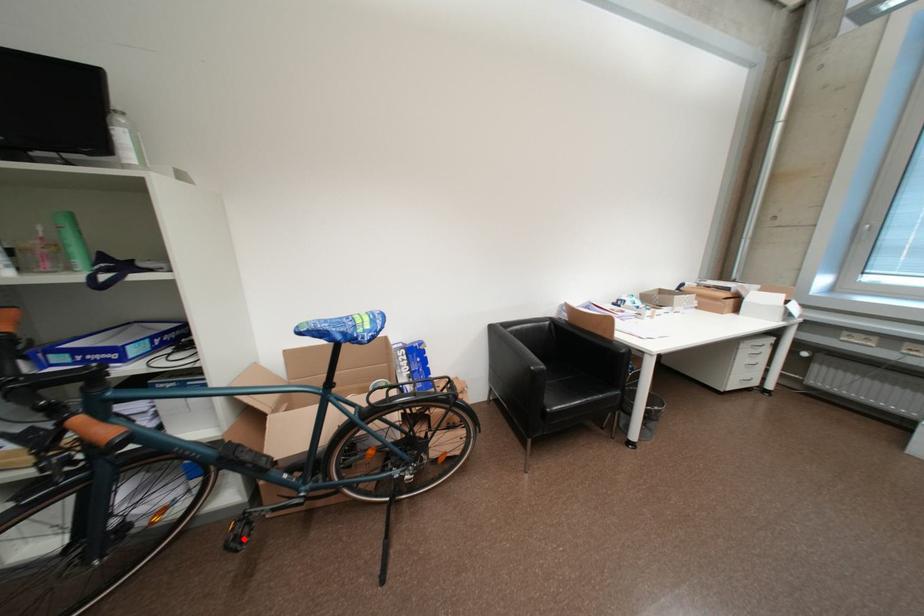
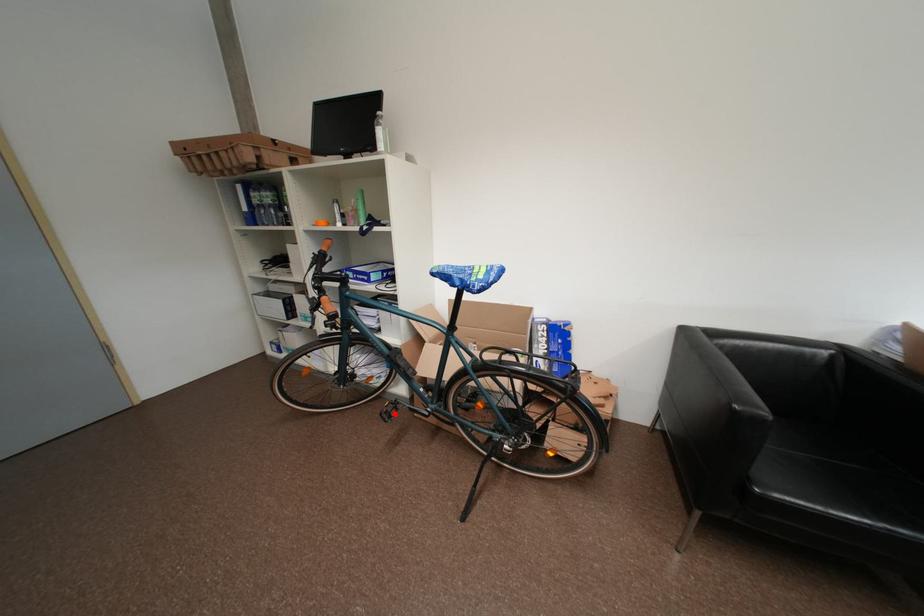
I am providing you with two images of the same scene from different viewpoints. A red point is marked on the first image and another point is marked on the second image. Does the point marked in image1 correspond to the same location as the one in image2?

Yes